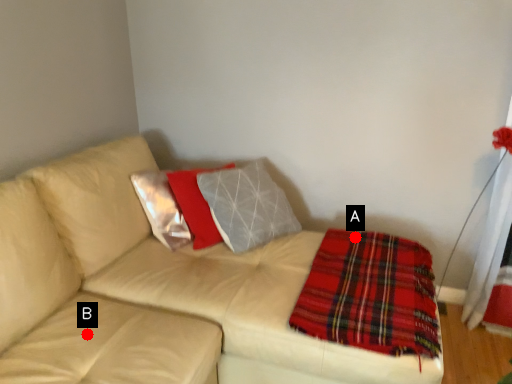
Question: Two points are circled on the image, labeled by A and B beside each circle. Which point appears closest to the camera in this image?

Choices:
 (A) A is closer
 (B) B is closer

Answer: (B)